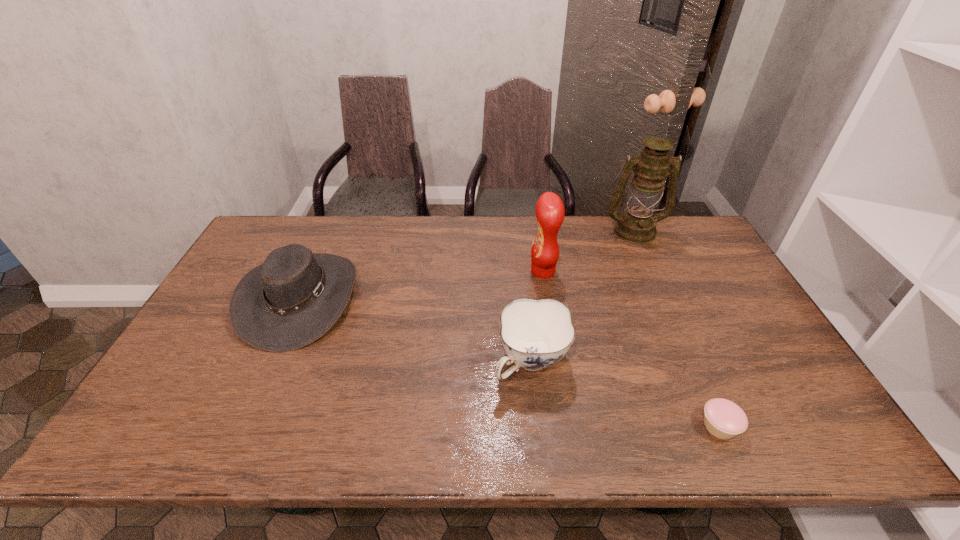
Identify the location of object that can be found as the closest to the shortest object. The width and height of the screenshot is (960, 540). (535, 334).

Identify which object is the second nearest to the chinaware. Please provide its 2D coordinates. Your answer should be formatted as a tuple, i.e. [(x, y)], where the tuple contains the x and y coordinates of a point satisfying the conditions above.

[(724, 419)]

Locate an element on the screen. blank area in the image that satisfies the following two spatial constraints: 1. on the front-facing side of the shortest object; 2. on the left side of the cowboy hat is located at coordinates (244, 427).

Locate an element on the screen. The height and width of the screenshot is (540, 960). free region that satisfies the following two spatial constraints: 1. on the label side of the second tallest object; 2. on the left side of the shortest object is located at coordinates (568, 427).

You are a GUI agent. You are given a task and a screenshot of the screen. Output one action in this format:
    pyautogui.click(x=<x>, y=<y>)
    Task: Click on the vacant space that satisfies the following two spatial constraints: 1. on the front-facing side of the shortest object; 2. on the right side of the cowboy hat
    
    Given the screenshot: What is the action you would take?
    pyautogui.click(x=244, y=427)

The width and height of the screenshot is (960, 540). I want to click on vacant space that satisfies the following two spatial constraints: 1. on the label side of the condiment; 2. on the back side of the shortest object, so click(568, 427).

Locate an element on the screen. The width and height of the screenshot is (960, 540). free space that satisfies the following two spatial constraints: 1. on the front-facing side of the leftmost object; 2. on the right side of the nearest object is located at coordinates (244, 427).

The height and width of the screenshot is (540, 960). What are the coordinates of `vacant position in the image that satisfies the following two spatial constraints: 1. on the back side of the oil lamp; 2. on the right side of the chinaware` in the screenshot? It's located at (516, 230).